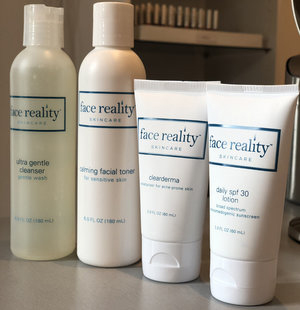
Identify the location of bottle. (33, 113), (93, 129).